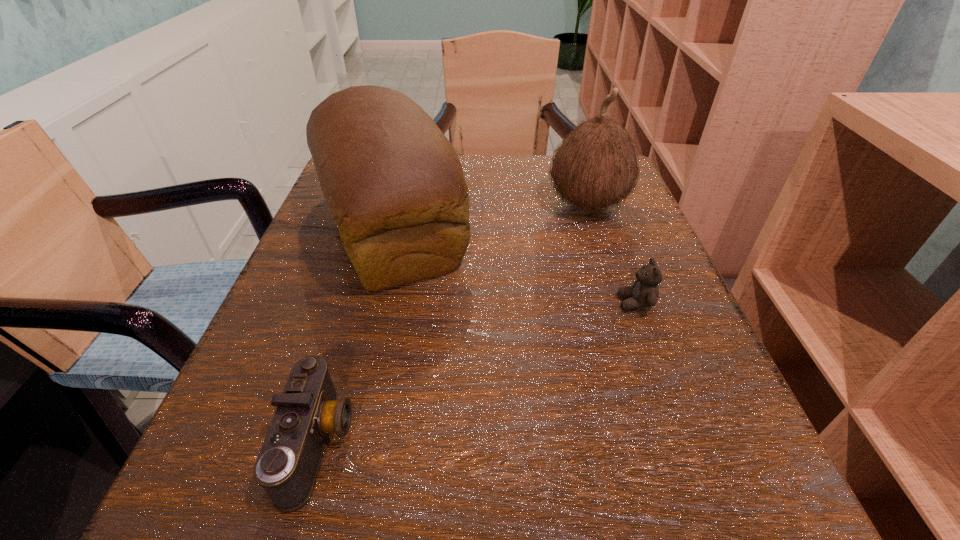
The image size is (960, 540). In order to click on free spot located 0.070m on the face of the teddy bear in this screenshot , I will do `click(575, 303)`.

This screenshot has height=540, width=960. Find the location of `free space located 0.150m on the lens of the nearest object`. free space located 0.150m on the lens of the nearest object is located at coordinates (473, 443).

Where is `coconut present at the far edge`? This screenshot has height=540, width=960. coconut present at the far edge is located at coordinates (596, 166).

Locate an element on the screen. bread that is at the far edge is located at coordinates (394, 184).

Locate an element on the screen. Image resolution: width=960 pixels, height=540 pixels. object that is at the near edge is located at coordinates (308, 410).

You are a GUI agent. You are given a task and a screenshot of the screen. Output one action in this format:
    pyautogui.click(x=<x>, y=<y>)
    Task: Click on the bread located in the left edge section of the desktop
    This screenshot has height=540, width=960.
    Given the screenshot: What is the action you would take?
    pyautogui.click(x=394, y=184)

Locate an element on the screen. This screenshot has height=540, width=960. camera at the left edge is located at coordinates (308, 410).

This screenshot has height=540, width=960. I want to click on coconut located in the right edge section of the desktop, so click(x=596, y=166).

Where is `teddy bear that is at the right edge`? teddy bear that is at the right edge is located at coordinates (644, 293).

I want to click on object at the far left corner, so click(x=394, y=184).